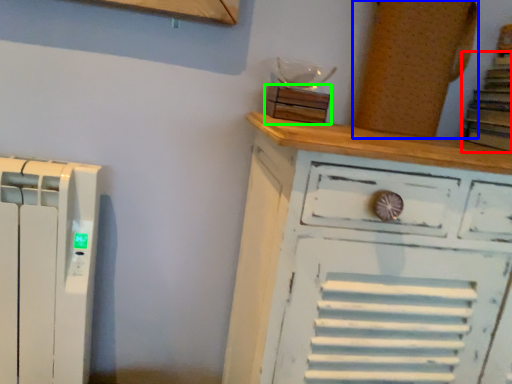
Question: Based on their relative distances, which object is farther from book (highlighted by a red box)? Choose from wood (highlighted by a blue box) and wood (highlighted by a green box).

Choices:
 (A) wood
 (B) wood

Answer: (B)